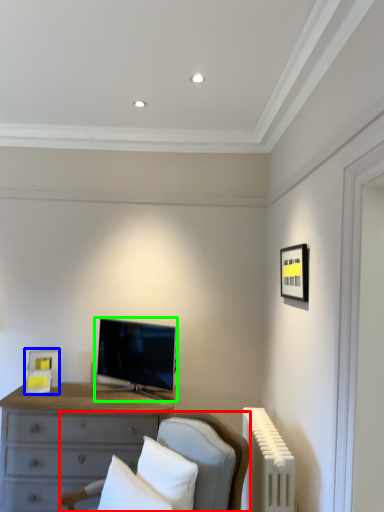
Question: Considering the real-world distances, which object is closest to furniture (highlighted by a red box)? picture frame (highlighted by a blue box) or television (highlighted by a green box).

Choices:
 (A) picture frame
 (B) television

Answer: (B)